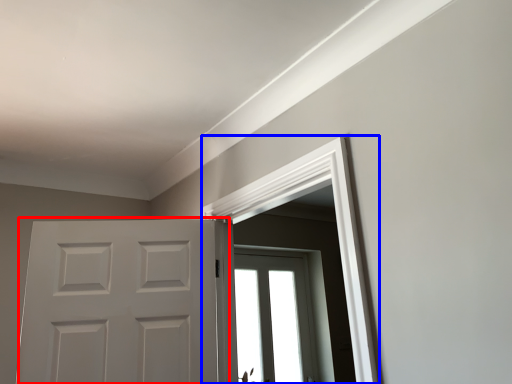
Question: Which point is closer to the camera, door (highlighted by a red box) or window frame (highlighted by a blue box)?

Choices:
 (A) door
 (B) window frame

Answer: (B)